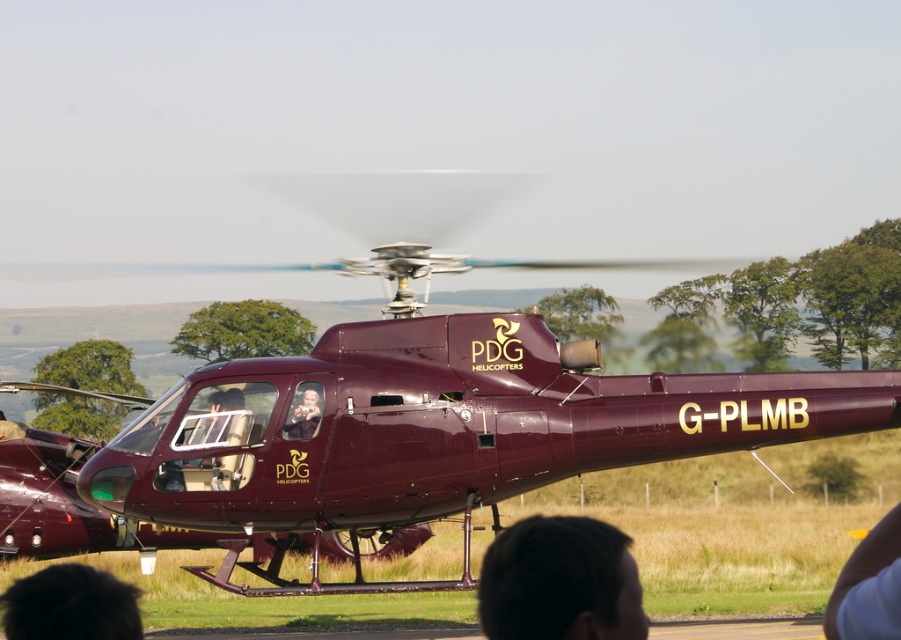
You are a photographer standing in front of the helicopter. You notice two people in the scene with dark brown hair at lower center and dark hair at lower left. Which person is closer to you?

The dark brown hair at lower center is closer to you because it is positioned in front of the dark hair at lower left.

You are a photographer trying to capture the exact location of the dark brown hair at lower center in the image. According to the coordinates provided, where would you focus your camera lens?

The dark brown hair at lower center is located at coordinates point (x=560, y=580), so you should focus your camera lens at that exact point to capture its precise location.

You are a photographer taking a picture of the helicopter. You notice two people in the scene, one with dark brown hair at lower center and another with dark hair at lower left. Which person is positioned higher in the frame?

The dark brown hair at lower center is much taller than dark hair at lower left, so the person with dark brown hair at lower center is positioned higher in the frame.